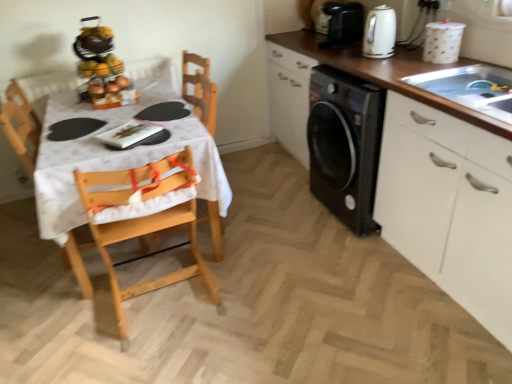
Question: Is white glossy cabinet at right oriented towards shiny plastic fruit basket at upper left?

Choices:
 (A) yes
 (B) no

Answer: (A)

Question: Considering the relative positions of white glossy cabinet at right and shiny plastic fruit basket at upper left in the image provided, is white glossy cabinet at right in front of shiny plastic fruit basket at upper left?

Choices:
 (A) yes
 (B) no

Answer: (A)

Question: Is white glossy cabinet at right wider than shiny plastic fruit basket at upper left?

Choices:
 (A) no
 (B) yes

Answer: (B)

Question: Does white glossy cabinet at right have a larger size compared to shiny plastic fruit basket at upper left?

Choices:
 (A) yes
 (B) no

Answer: (A)

Question: Does white glossy cabinet at right have a lesser height compared to shiny plastic fruit basket at upper left?

Choices:
 (A) no
 (B) yes

Answer: (A)

Question: Is white glossy cabinet at right positioned behind shiny plastic fruit basket at upper left?

Choices:
 (A) no
 (B) yes

Answer: (A)

Question: From the image's perspective, is wooden highchair at left located above white fabric tablecloth at left?

Choices:
 (A) no
 (B) yes

Answer: (A)

Question: Is there a large distance between wooden highchair at left and white fabric tablecloth at left?

Choices:
 (A) yes
 (B) no

Answer: (B)

Question: Is the depth of wooden highchair at left greater than that of white fabric tablecloth at left?

Choices:
 (A) yes
 (B) no

Answer: (B)

Question: Can you confirm if wooden highchair at left is positioned to the left of white fabric tablecloth at left?

Choices:
 (A) yes
 (B) no

Answer: (B)

Question: Can white fabric tablecloth at left be found inside wooden highchair at left?

Choices:
 (A) yes
 (B) no

Answer: (B)

Question: From the image's perspective, is wooden highchair at left below white fabric tablecloth at left?

Choices:
 (A) no
 (B) yes

Answer: (B)

Question: Is white glossy cabinet at right to the left of white glossy kettle at upper right from the viewer's perspective?

Choices:
 (A) yes
 (B) no

Answer: (B)